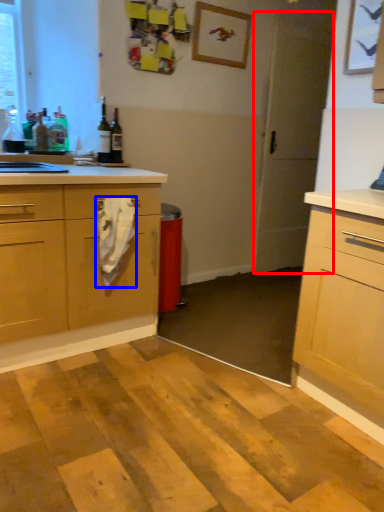
Question: Among these objects, which one is nearest to the camera, screen door (highlighted by a red box) or material (highlighted by a blue box)?

Choices:
 (A) screen door
 (B) material

Answer: (B)